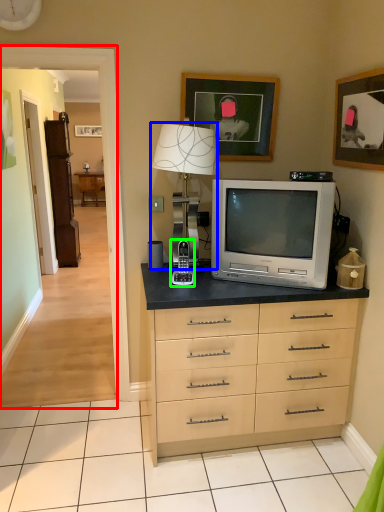
Question: Considering the real-world distances, which object is farthest from corridor (highlighted by a red box)? table lamp (highlighted by a blue box) or appliance (highlighted by a green box)?

Choices:
 (A) table lamp
 (B) appliance

Answer: (B)